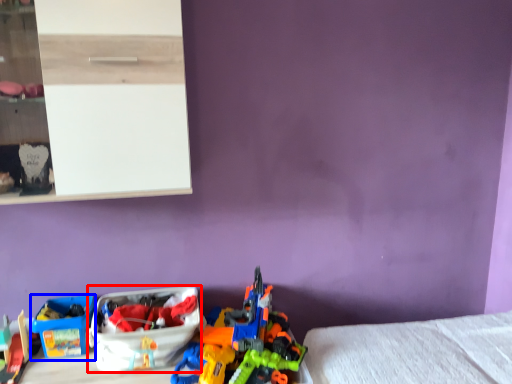
Question: Which of the following is the farthest to the observer, storage box (highlighted by a red box) or storage box (highlighted by a blue box)?

Choices:
 (A) storage box
 (B) storage box

Answer: (B)